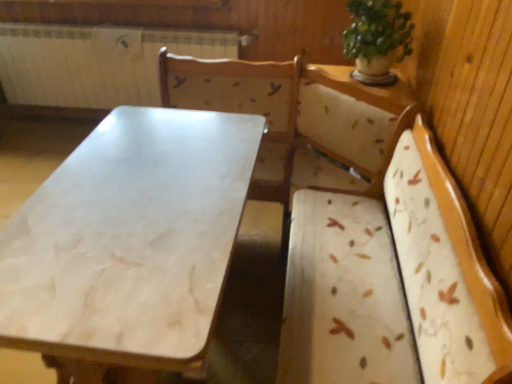
Question: From a real-world perspective, is white marble table at center under green leafy plant at upper right?

Choices:
 (A) no
 (B) yes

Answer: (B)

Question: Could you tell me if white marble table at center is turned towards green leafy plant at upper right?

Choices:
 (A) yes
 (B) no

Answer: (B)

Question: Is white marble table at center thinner than green leafy plant at upper right?

Choices:
 (A) yes
 (B) no

Answer: (B)

Question: From the image's perspective, is white marble table at center located beneath green leafy plant at upper right?

Choices:
 (A) yes
 (B) no

Answer: (A)

Question: Does white marble table at center have a larger size compared to green leafy plant at upper right?

Choices:
 (A) yes
 (B) no

Answer: (A)

Question: Considering the positions of white marble table at center and white painted metal radiator at upper left in the image, is white marble table at center bigger or smaller than white painted metal radiator at upper left?

Choices:
 (A) small
 (B) big

Answer: (B)

Question: Considering the positions of point (164, 324) and point (58, 82), is point (164, 324) closer or farther from the camera than point (58, 82)?

Choices:
 (A) closer
 (B) farther

Answer: (A)

Question: Looking at their shapes, would you say white marble table at center is wider or thinner than white painted metal radiator at upper left?

Choices:
 (A) wide
 (B) thin

Answer: (A)

Question: From the image's perspective, is white marble table at center located above or below white painted metal radiator at upper left?

Choices:
 (A) below
 (B) above

Answer: (A)

Question: Is point tap(393, 3) closer or farther from the camera than point tap(15, 29)?

Choices:
 (A) closer
 (B) farther

Answer: (A)

Question: Is green leafy plant at upper right inside or outside of white painted metal radiator at upper left?

Choices:
 (A) outside
 (B) inside

Answer: (A)

Question: In terms of size, does green leafy plant at upper right appear bigger or smaller than white painted metal radiator at upper left?

Choices:
 (A) big
 (B) small

Answer: (B)

Question: From the image's perspective, relative to white painted metal radiator at upper left, is green leafy plant at upper right above or below?

Choices:
 (A) above
 (B) below

Answer: (B)

Question: Considering the positions of white painted metal radiator at upper left and green leafy plant at upper right in the image, is white painted metal radiator at upper left bigger or smaller than green leafy plant at upper right?

Choices:
 (A) big
 (B) small

Answer: (A)

Question: In terms of height, does white painted metal radiator at upper left look taller or shorter compared to green leafy plant at upper right?

Choices:
 (A) short
 (B) tall

Answer: (B)